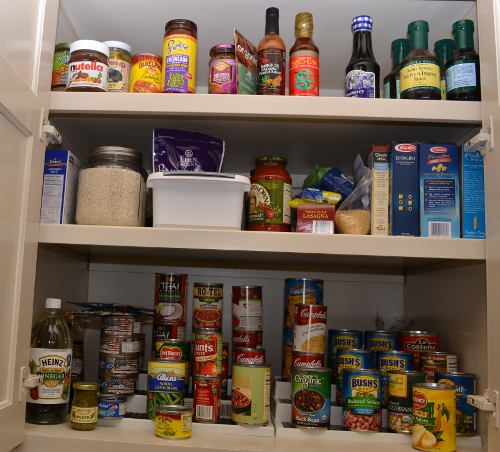
I want to click on jars, so coord(77,407), coord(272,203), coord(222,73), coord(178,72), coord(121,75), coord(93,75), coord(59,74).